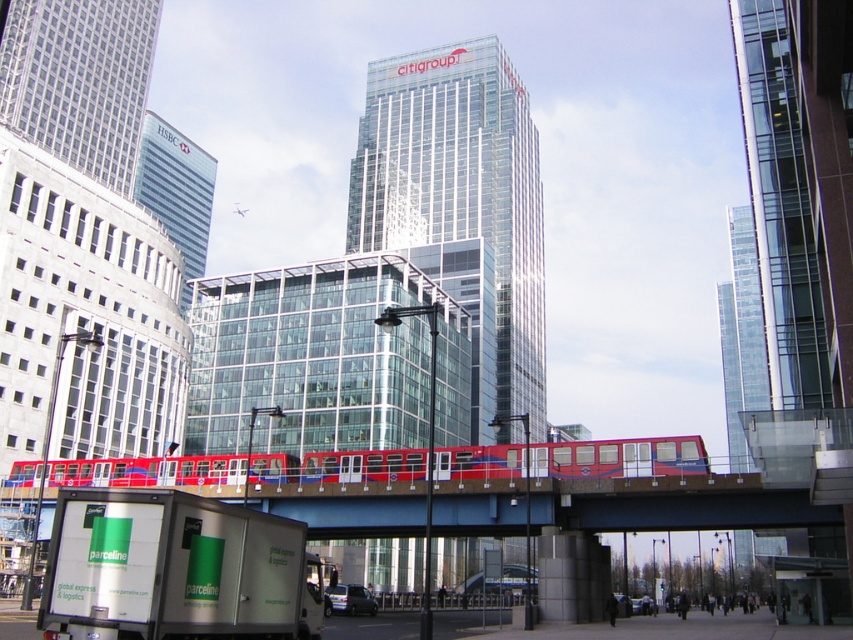
You are a city planner analyzing traffic flow. You need to decide which object, the white matte truck at lower left or the red metallic train at center, requires more space for maneuvering in the scene. Based on the spatial details, which one would you prioritize for wider pathways?

The red metallic train at center requires more space for maneuvering because the white matte truck at lower left occupies less space than it. Therefore, wider pathways should be prioritized for the red metallic train at center.